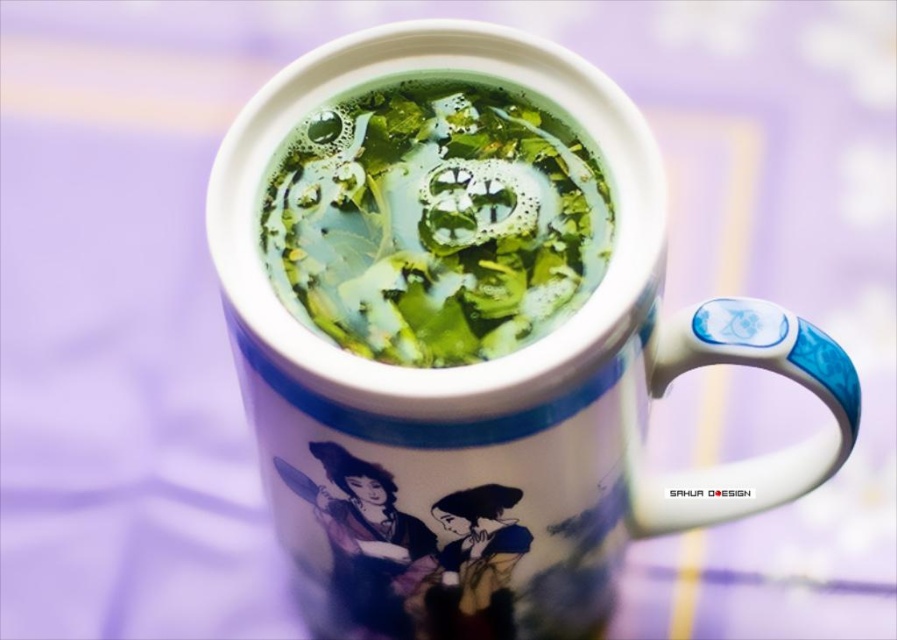
Question: Does white glossy mug at center have a lesser width compared to green matte tea at center?

Choices:
 (A) yes
 (B) no

Answer: (B)

Question: Is white glossy mug at center to the left of green matte tea at center from the viewer's perspective?

Choices:
 (A) yes
 (B) no

Answer: (B)

Question: Which point appears farthest from the camera in this image?

Choices:
 (A) (608, 221)
 (B) (491, 362)

Answer: (A)

Question: Among these objects, which one is nearest to the camera?

Choices:
 (A) green matte tea at center
 (B) white glossy mug at center

Answer: (B)

Question: Is white glossy mug at center thinner than green matte tea at center?

Choices:
 (A) yes
 (B) no

Answer: (B)